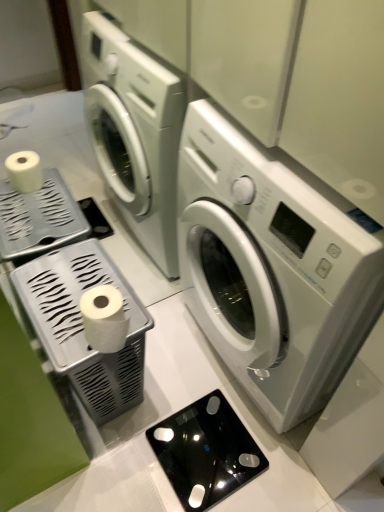
I want to click on vacant space in between white glossy washing machine at center and black glass scale at lower center, the 1th appliance in the right-to-left sequence, so click(187, 371).